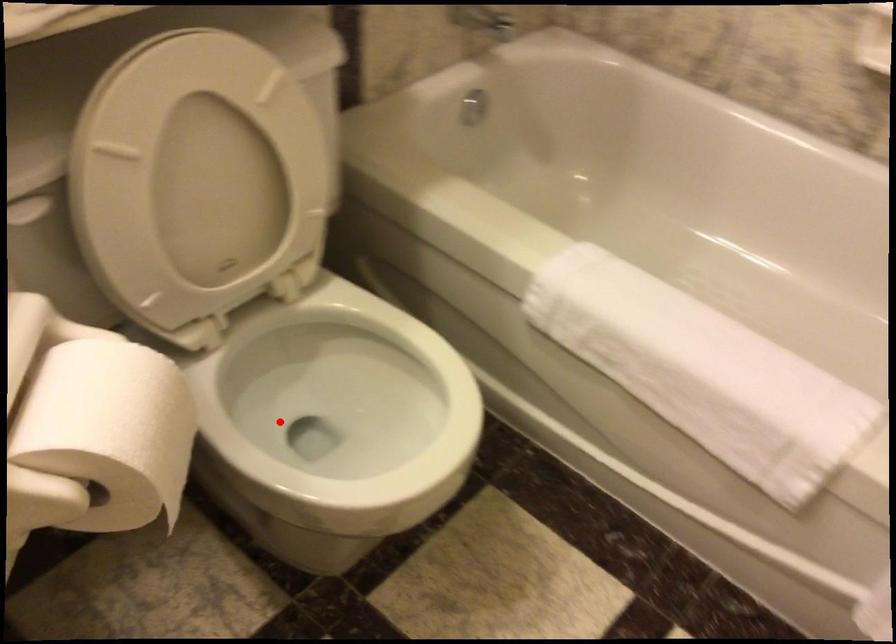
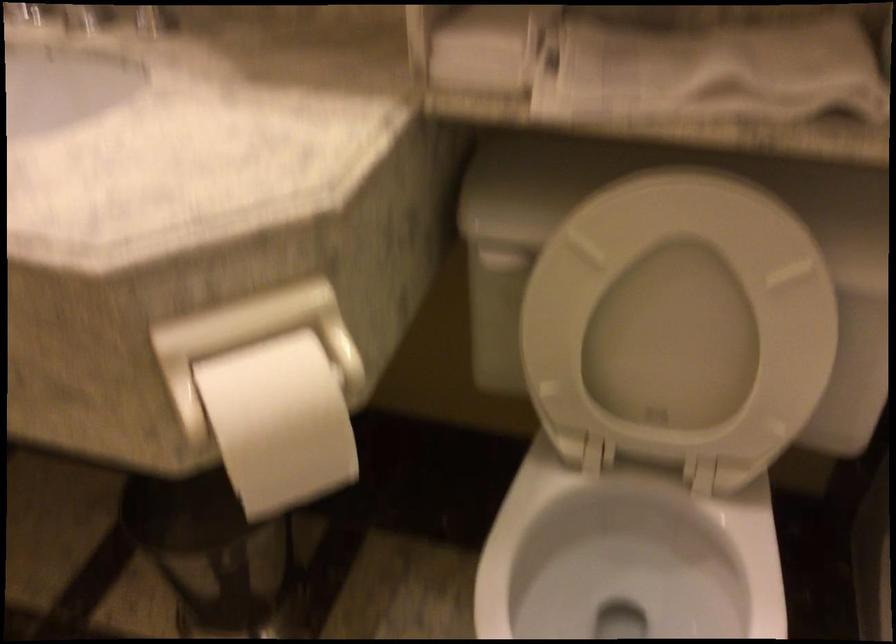
In the second image, find the point that corresponds to the highlighted location in the first image.

(609, 574)